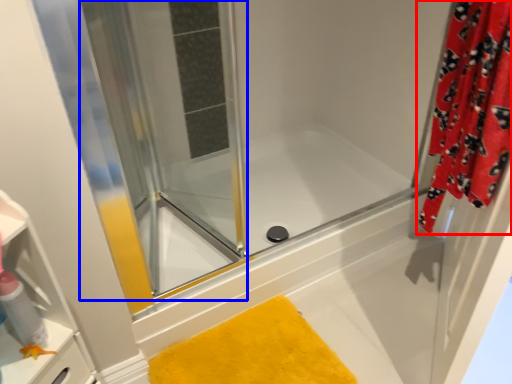
Question: Which object is further to the camera taking this photo, curtain (highlighted by a red box) or screen door (highlighted by a blue box)?

Choices:
 (A) curtain
 (B) screen door

Answer: (B)